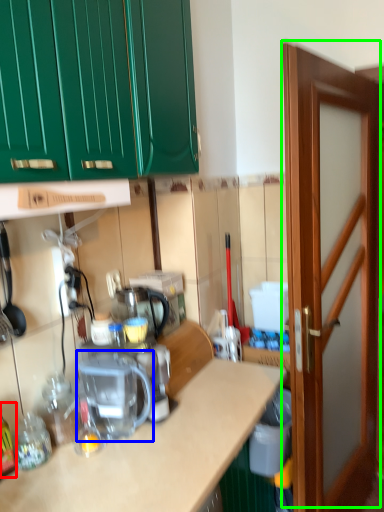
Question: Based on their relative distances, which object is nearer to bottle (highlighted by a red box)? Choose from coffee machine (highlighted by a blue box) and door (highlighted by a green box).

Choices:
 (A) coffee machine
 (B) door

Answer: (A)